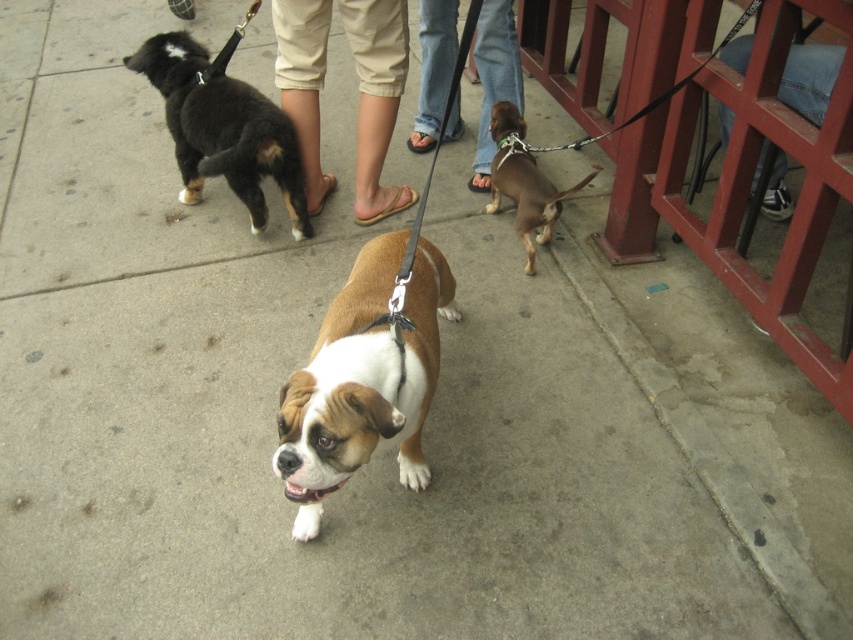
Question: Which object appears farthest from the camera in this image?

Choices:
 (A) tan fabric pants at center
 (B) brown leather shoes at center

Answer: (B)

Question: Does black fur dog at left have a greater width compared to jeans at right?

Choices:
 (A) no
 (B) yes

Answer: (B)

Question: Which point is closer to the camera?

Choices:
 (A) brown/white fur dog at center
 (B) black fur dog at left
 (C) brown leather shoes at center

Answer: (A)

Question: Is tan fabric pants at center positioned before brown smooth dog at center?

Choices:
 (A) yes
 (B) no

Answer: (B)

Question: Which is farther from the tan fabric pants at center?

Choices:
 (A) brown/white fur dog at center
 (B) brown leather shoes at center
 (C) brown smooth dog at center
 (D) black fur dog at left

Answer: (A)

Question: Is brown leather shoes at center thinner than brown smooth dog at center?

Choices:
 (A) no
 (B) yes

Answer: (A)